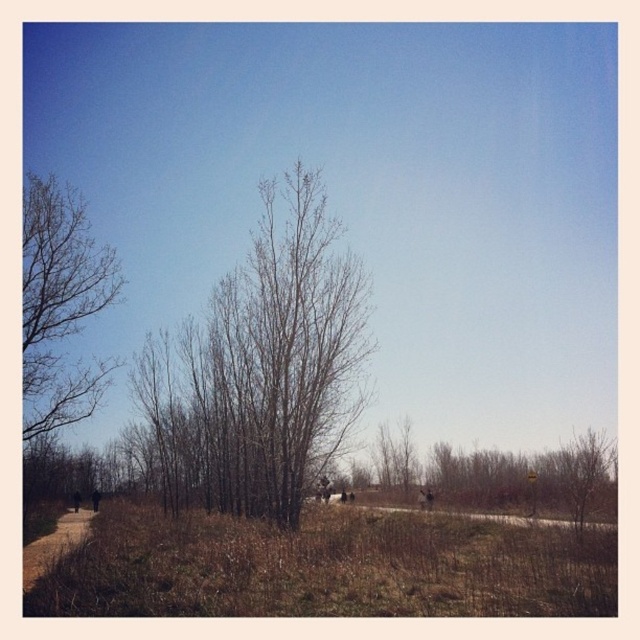
You are a hiker trying to navigate through the outdoor scene. You see the bare wood tree at center and the dark clothing figure at lower left. Which object is bigger in size?

The bare wood tree at center has a larger size compared to the dark clothing figure at lower left.